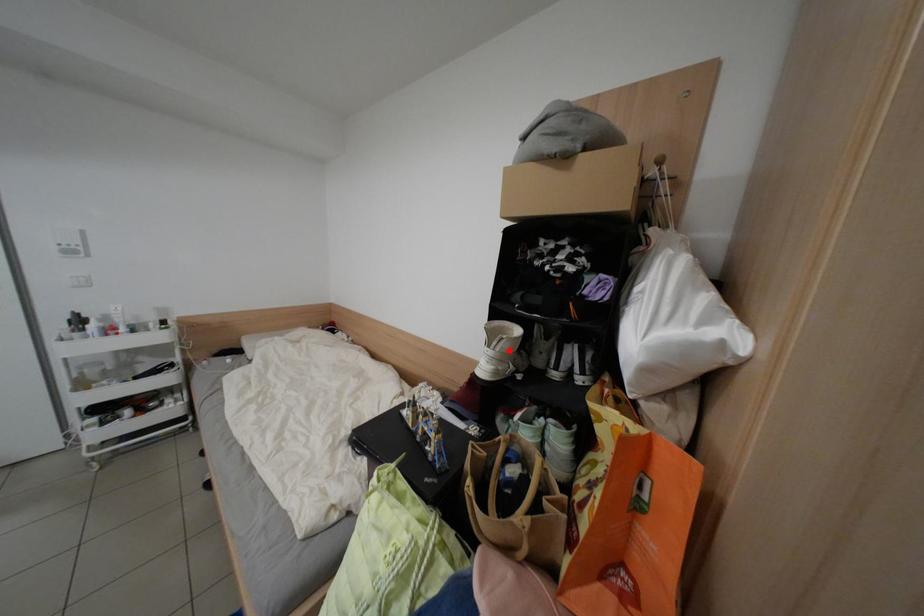
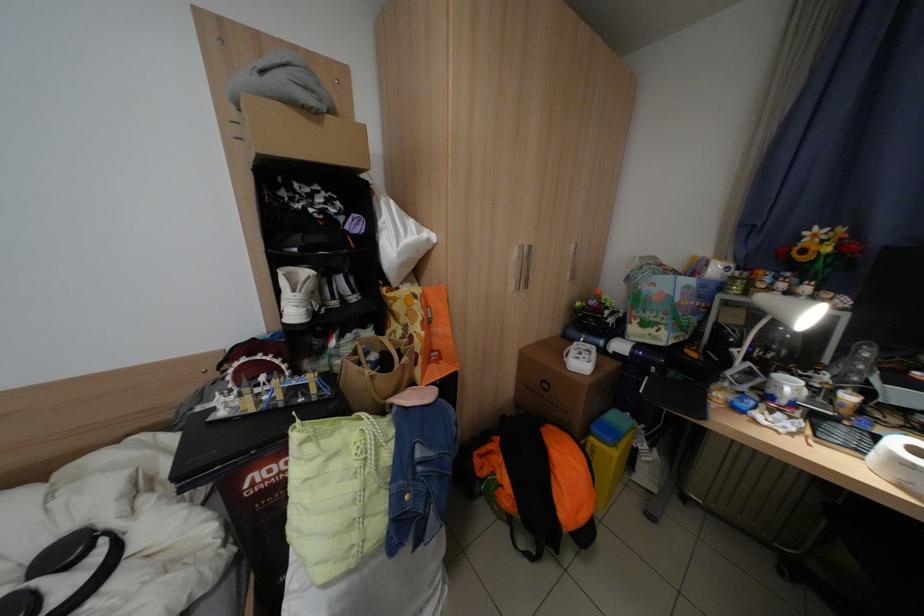
Find the pixel in the second image that matches the highlighted location in the first image.

(314, 292)